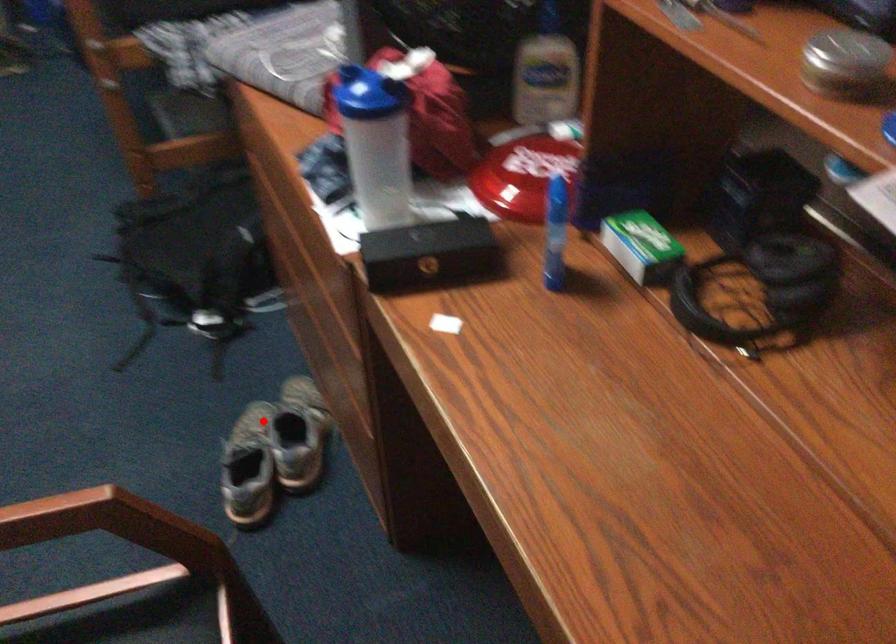
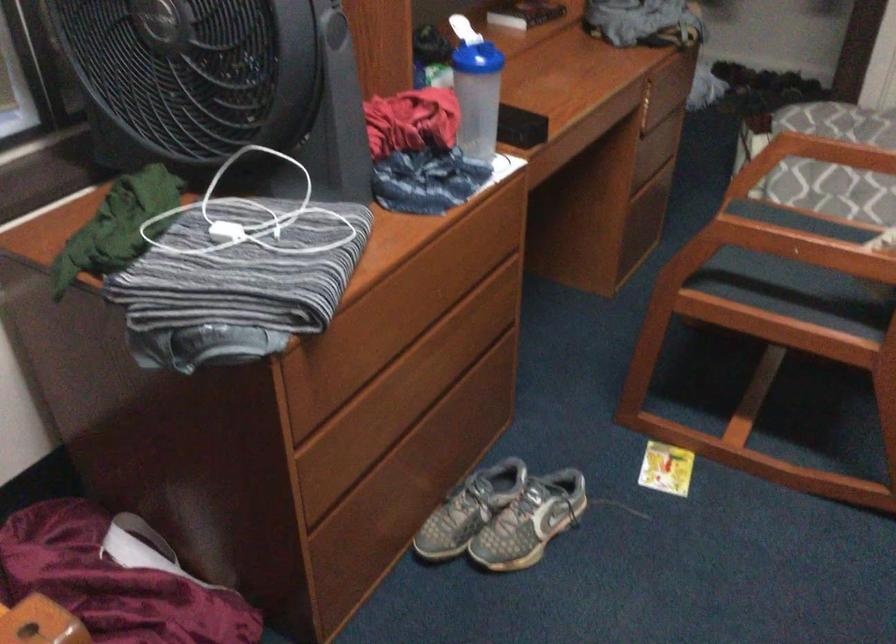
The point at the highlighted location is marked in the first image. Where is the corresponding point in the second image?

(503, 516)